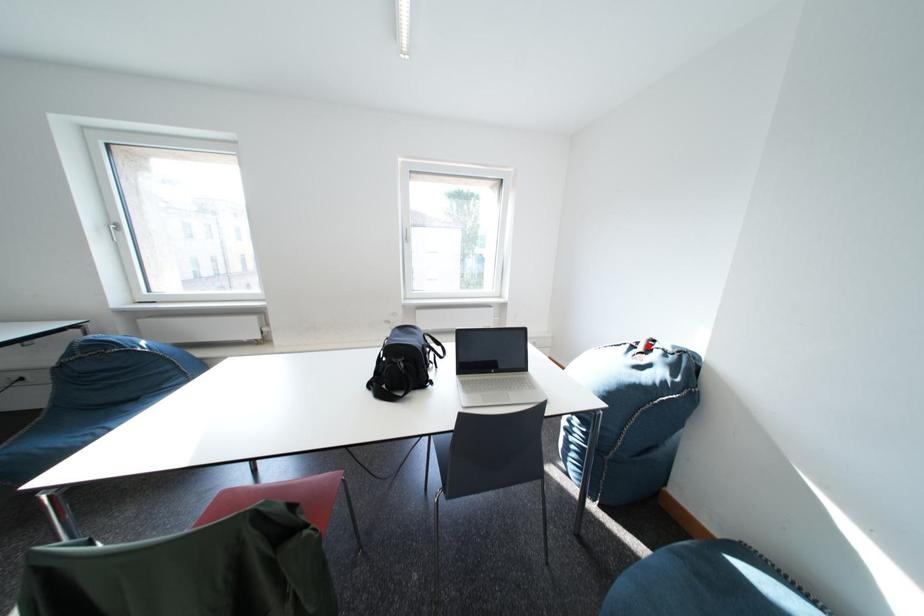
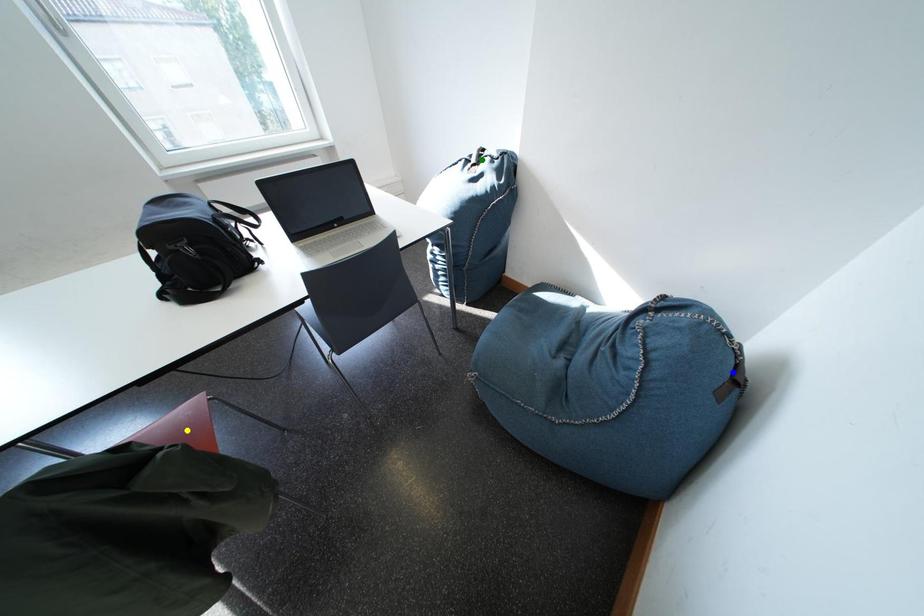
Question: I am providing you with two images of the same scene from different viewpoints. A red point is marked on the first image. You are given multiple points on the second image. In image 2, which mark is for the same physical point as the one in image 1?

Choices:
 (A) yellow point
 (B) green point
 (C) blue point

Answer: (B)